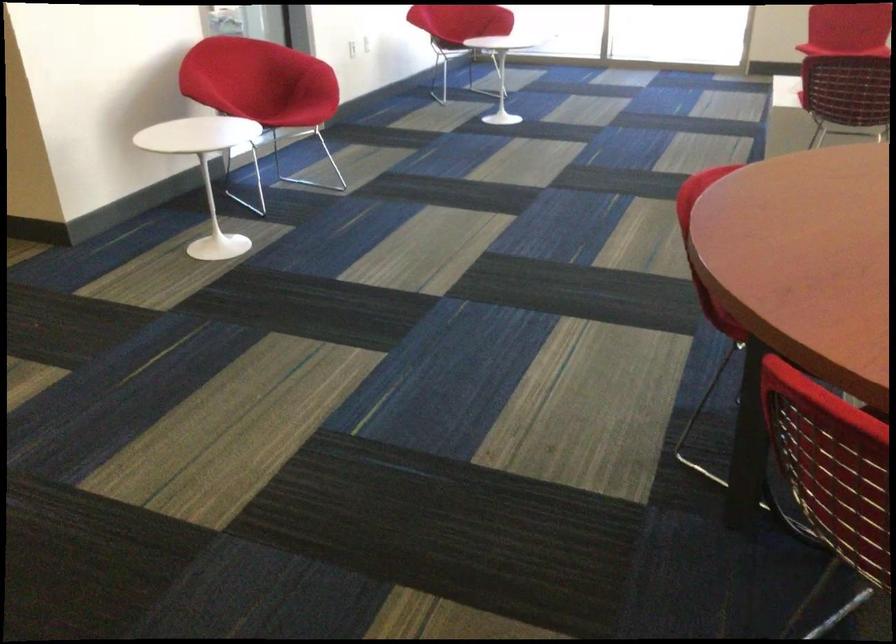
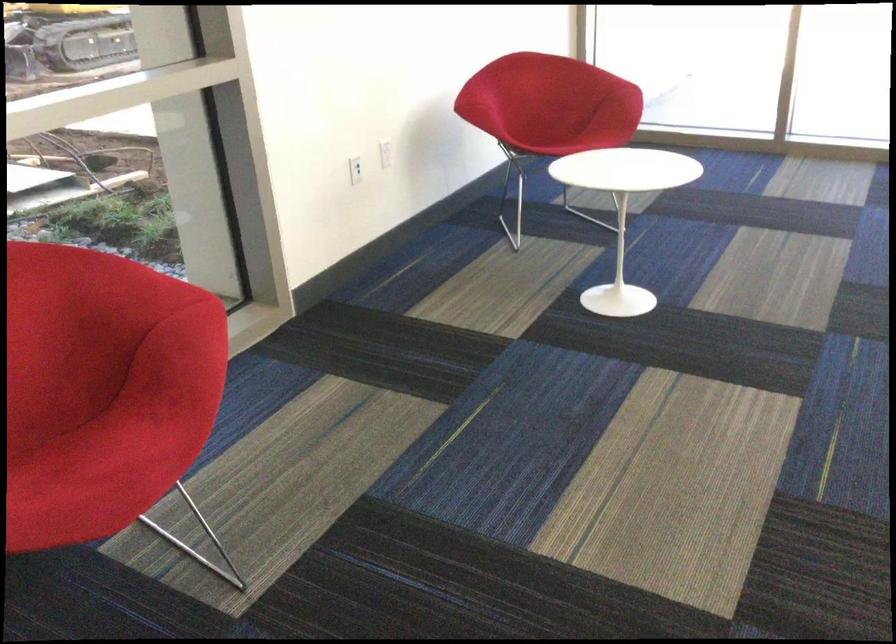
Locate, in the second image, the point that corresponds to pixel 288 122 in the first image.

(115, 450)